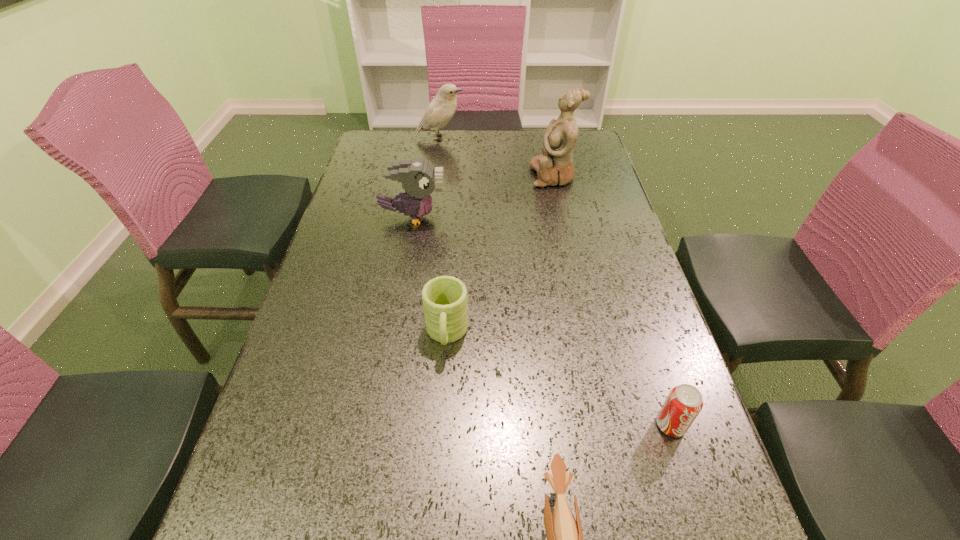
Identify the location of vacant point located between the tallest object and the fourth farthest object. (500, 255).

This screenshot has height=540, width=960. In order to click on object that is the fourth closest to the rightmost bird in this screenshot , I will do `click(555, 167)`.

Identify which object is the fourth closest to the soda can. Please provide its 2D coordinates. Your answer should be formatted as a tuple, i.e. [(x, y)], where the tuple contains the x and y coordinates of a point satisfying the conditions above.

[(555, 167)]

This screenshot has width=960, height=540. In order to click on bird that stands as the closest to the nearest bird in this screenshot , I will do `click(419, 178)`.

The image size is (960, 540). I want to click on the third closest bird relative to the third nearest object, so click(442, 108).

You are a GUI agent. You are given a task and a screenshot of the screen. Output one action in this format:
    pyautogui.click(x=<x>, y=<y>)
    Task: Click on the free space that satisfies the following two spatial constraints: 1. on the front-facing side of the figurine; 2. on the side of the third nearest object with the handle
    The width and height of the screenshot is (960, 540).
    Given the screenshot: What is the action you would take?
    pyautogui.click(x=588, y=334)